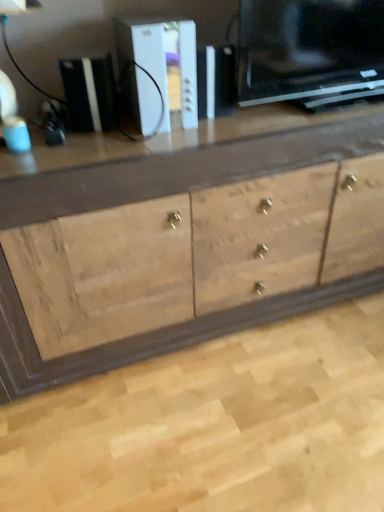
Question: Do you think white plastic gaming console at upper center, the 1th appliance when ordered from left to right, is within natural wood cabinet at center, or outside of it?

Choices:
 (A) inside
 (B) outside

Answer: (B)

Question: Considering the positions of point (77, 106) and point (302, 306), is point (77, 106) closer or farther from the camera than point (302, 306)?

Choices:
 (A) farther
 (B) closer

Answer: (B)

Question: Which object is the farthest from the white plastic console at center, which is counted as the 1th appliance, starting from the right?

Choices:
 (A) white plastic gaming console at upper center, the 1th appliance when ordered from left to right
 (B) natural wood cabinet at center

Answer: (B)

Question: Which is nearer to the white plastic gaming console at upper center, the second appliance when ordered from right to left?

Choices:
 (A) natural wood cabinet at center
 (B) white plastic console at center, which is counted as the 1th appliance, starting from the right

Answer: (B)